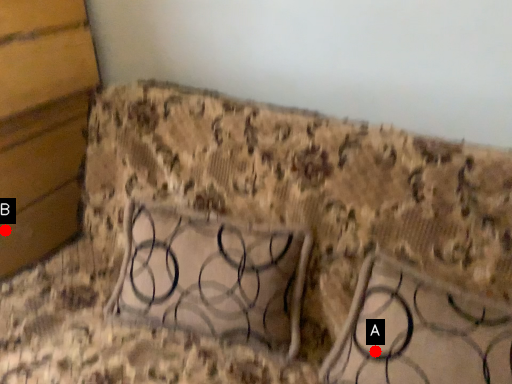
Question: Two points are circled on the image, labeled by A and B beside each circle. Which point is further to the camera?

Choices:
 (A) A is further
 (B) B is further

Answer: (B)